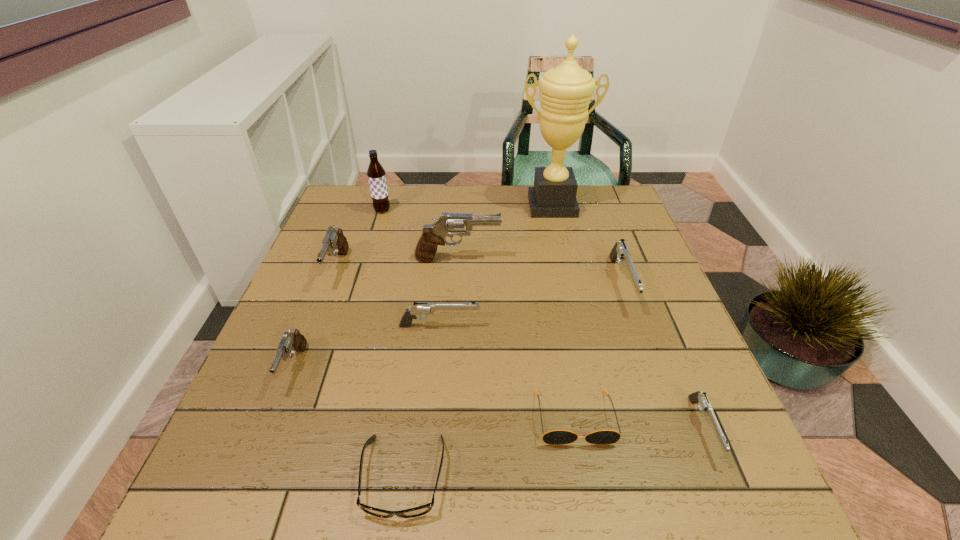
Find the location of a particular element. vacant position in the image that satisfies the following two spatial constraints: 1. at the front of the tallest object with handles; 2. at the barrel of the biggest gray pistol is located at coordinates (564, 259).